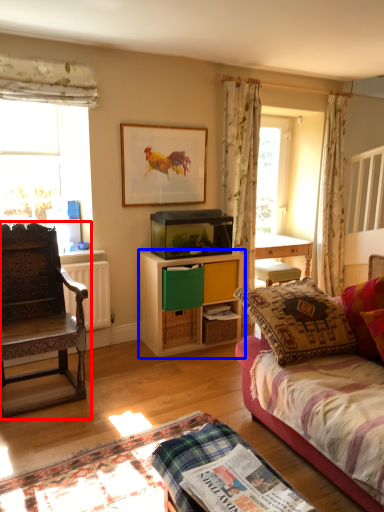
Question: Which object is closer to the camera taking this photo, chair (highlighted by a red box) or cabinetry (highlighted by a blue box)?

Choices:
 (A) chair
 (B) cabinetry

Answer: (A)